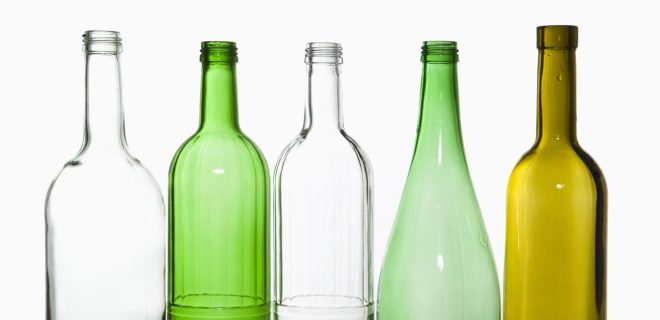
Identify the location of bottles. The image size is (660, 320). point(90,231), point(204,231), point(315,229), point(457,271), point(538,254).